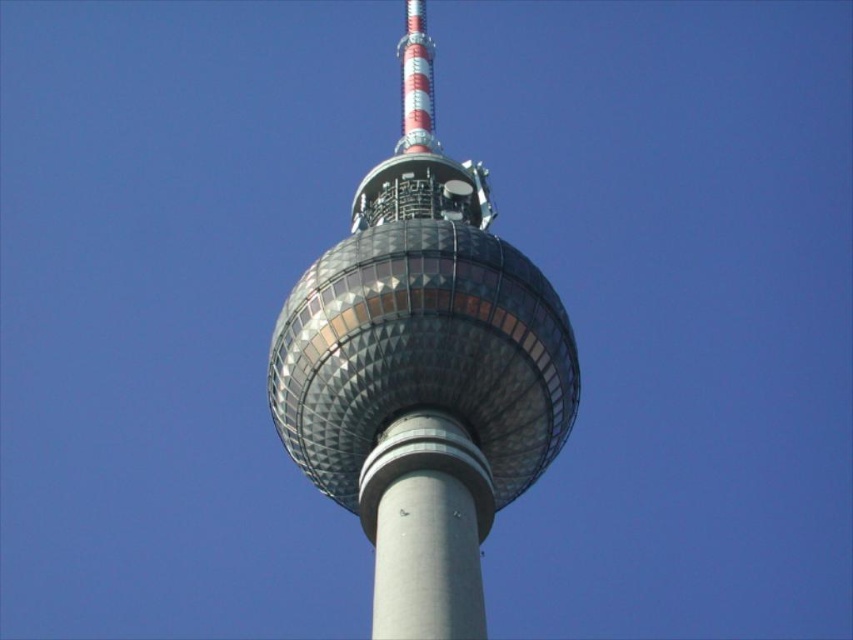
You are standing at the base of the Berliner Fernsehturm and want to take a photo of the shiny glass sphere at center with your camera. The camera is 1.5 meters tall. Will the camera be able to reach the sphere?

The shiny glass sphere at center and camera are 48.61 meters apart from each other. Since the camera is 1.5 meters tall, it can capture the sphere in the photo as the distance between them is not a limitation for the camera to focus on the subject.

You are an architect evaluating the Berlin Fernsehturm design. The shiny glass sphere at center and the gray concrete pole at center are key elements. Which of these two elements has a greater diameter?

The shiny glass sphere at center has a larger size compared to the gray concrete pole at center, so the sphere has a greater diameter.

You are standing in front of the Berliner Fernsehturm and want to take a photo of the shiny glass sphere at center and the gray concrete pole at center. Which object will appear larger in your camera viewfinder?

The shiny glass sphere at center will appear larger in your camera viewfinder because it is closer to you than the gray concrete pole at center.